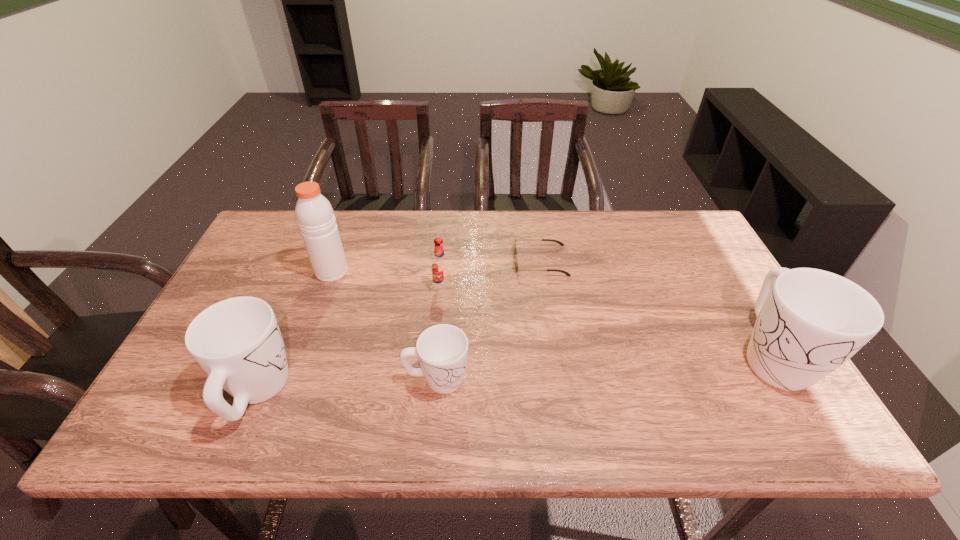
Where is `blank area in the image that satisfies the following two spatial constraints: 1. on the side of the rightmost mug with the handle; 2. on the side of the second mug from left to right with the handle`? The image size is (960, 540). blank area in the image that satisfies the following two spatial constraints: 1. on the side of the rightmost mug with the handle; 2. on the side of the second mug from left to right with the handle is located at coordinates (786, 379).